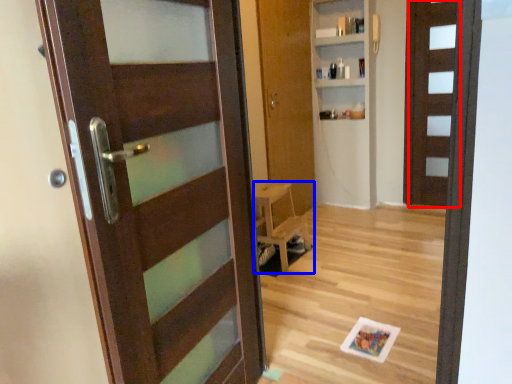
Question: Which object is closer to the camera taking this photo, door (highlighted by a red box) or furniture (highlighted by a blue box)?

Choices:
 (A) door
 (B) furniture

Answer: (B)